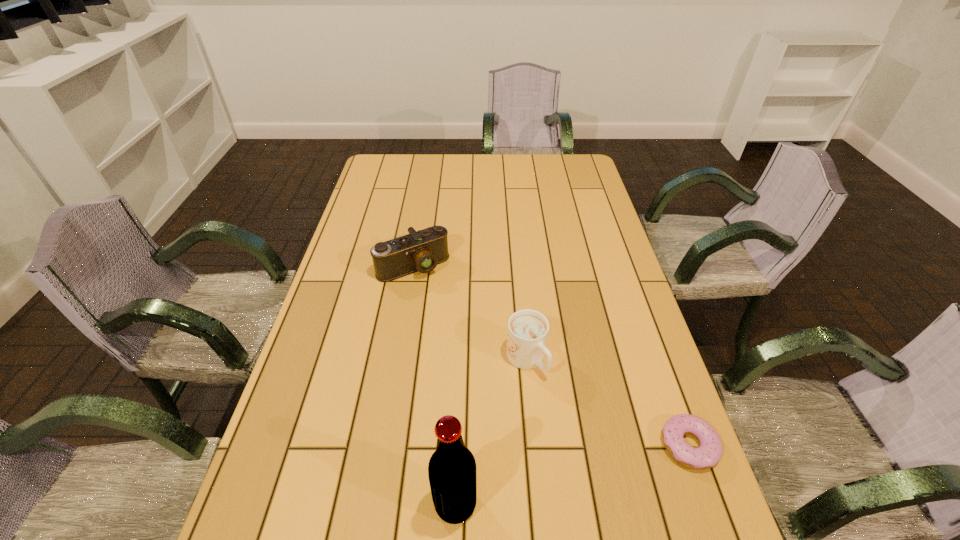
The width and height of the screenshot is (960, 540). In the image, there is a desktop. Find the location of `vacant space at the left edge`. vacant space at the left edge is located at coordinates (358, 234).

Locate an element on the screen. vacant space at the right edge of the desktop is located at coordinates (638, 326).

The image size is (960, 540). In order to click on vacant space at the far left corner in this screenshot , I will do `click(385, 158)`.

Locate an element on the screen. vacant space at the far right corner is located at coordinates (566, 165).

What are the coordinates of `free area in between the tallest object and the doughnut` in the screenshot? It's located at (572, 475).

Locate an element on the screen. This screenshot has width=960, height=540. empty space that is in between the second object from left to right and the doughnut is located at coordinates (572, 475).

This screenshot has width=960, height=540. What are the coordinates of `free point between the camera and the third nearest object` in the screenshot? It's located at (469, 313).

The width and height of the screenshot is (960, 540). What are the coordinates of `empty space that is in between the second nearest object and the beer bottle` in the screenshot? It's located at (572, 475).

Where is `free spot between the second object from left to right and the cappuccino`? This screenshot has width=960, height=540. free spot between the second object from left to right and the cappuccino is located at coordinates (491, 432).

At what (x,y) coordinates should I click in order to perform the action: click on vacant area that lies between the third object from left to right and the second nearest object. Please return your answer as a coordinate pair (x, y). This screenshot has width=960, height=540. Looking at the image, I should click on (608, 402).